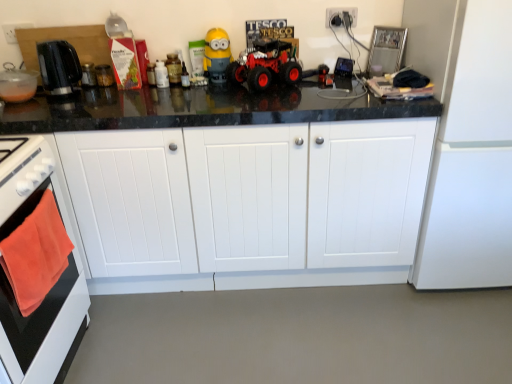
This screenshot has width=512, height=384. Find the location of `free spot below matte black kettle at left, which appears as the third appliance when viewed from the right (from a real-world perspective)`. free spot below matte black kettle at left, which appears as the third appliance when viewed from the right (from a real-world perspective) is located at coordinates (26, 96).